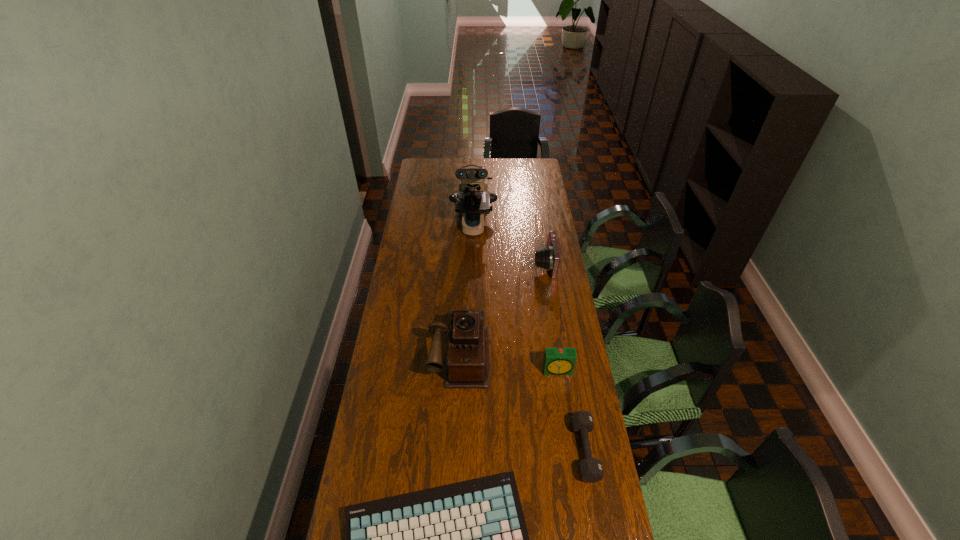
Where is `vacant position located 0.250m on the front-facing side of the alarm clock`? This screenshot has height=540, width=960. vacant position located 0.250m on the front-facing side of the alarm clock is located at coordinates (569, 444).

Locate an element on the screen. vacant point located 0.110m on the back of the dumbbell is located at coordinates tap(574, 391).

Locate an element on the screen. The width and height of the screenshot is (960, 540). camera present at the right edge is located at coordinates (548, 258).

Locate an element on the screen. This screenshot has width=960, height=540. alarm clock at the right edge is located at coordinates (557, 361).

Identify the location of dumbbell present at the right edge. (590, 469).

At what (x,y) coordinates should I click in order to perform the action: click on vacant region at the far edge. Please return your answer as a coordinate pair (x, y). Looking at the image, I should click on (450, 178).

Where is `blank space at the left edge of the desktop`? The width and height of the screenshot is (960, 540). blank space at the left edge of the desktop is located at coordinates (442, 186).

I want to click on vacant space at the right edge, so click(x=559, y=344).

You are a GUI agent. You are given a task and a screenshot of the screen. Output one action in this format:
    pyautogui.click(x=<x>, y=<y>)
    Task: Click on the free space at the far left corner
    This screenshot has width=960, height=540.
    Given the screenshot: What is the action you would take?
    pyautogui.click(x=425, y=171)

Find the location of a particular element. This screenshot has width=960, height=540. vacant space in between the alarm clock and the second shortest object is located at coordinates (571, 410).